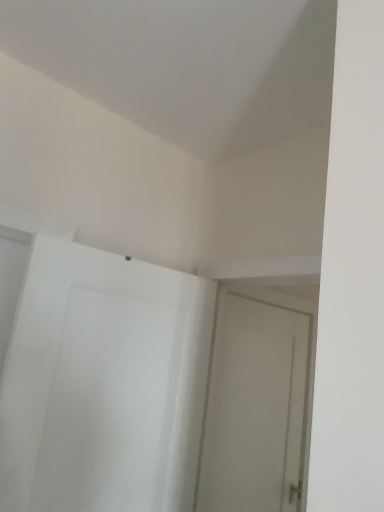
The image size is (384, 512). What do you see at coordinates (257, 403) in the screenshot?
I see `white matte door at center` at bounding box center [257, 403].

Where is `white matte door at center`? The width and height of the screenshot is (384, 512). white matte door at center is located at coordinates (257, 403).

At what (x,y) coordinates should I click in order to perform the action: click on white matte door at center. Please return your answer as a coordinate pair (x, y). Looking at the image, I should click on (257, 403).